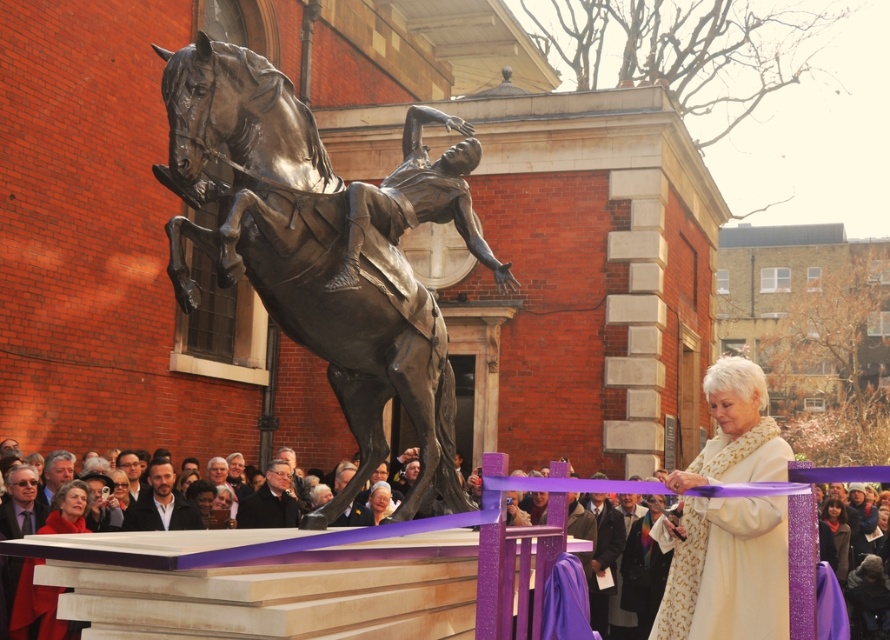
Is point (168, 508) in front of point (268, 525)?

Yes, point (168, 508) is in front of point (268, 525).

Which is in front, point (185, 500) or point (260, 502)?

Positioned in front is point (185, 500).

At what (x,y) coordinates should I click in order to perform the action: click on smooth black suit at center. Please return your answer as a coordinate pair (x, y). The height and width of the screenshot is (640, 890). Looking at the image, I should click on (160, 502).

Can you confirm if matte black suit at lower left is positioned below smooth brown hair at center?

Incorrect, matte black suit at lower left is not positioned below smooth brown hair at center.

Who is more forward, (x=65, y=454) or (x=139, y=461)?

Point (x=65, y=454) is more forward.

I want to click on matte black suit at lower left, so click(x=55, y=472).

Is matte red coat at lower left below dark gray suit at center?

Actually, matte red coat at lower left is above dark gray suit at center.

You are a GUI agent. You are given a task and a screenshot of the screen. Output one action in this format:
    pyautogui.click(x=<x>, y=<y>)
    Task: Click on the matte red coat at lower left
    
    Given the screenshot: What is the action you would take?
    pyautogui.click(x=35, y=608)

Image resolution: width=890 pixels, height=640 pixels. What are the coordinates of `matte red coat at lower left` in the screenshot? It's located at (35, 608).